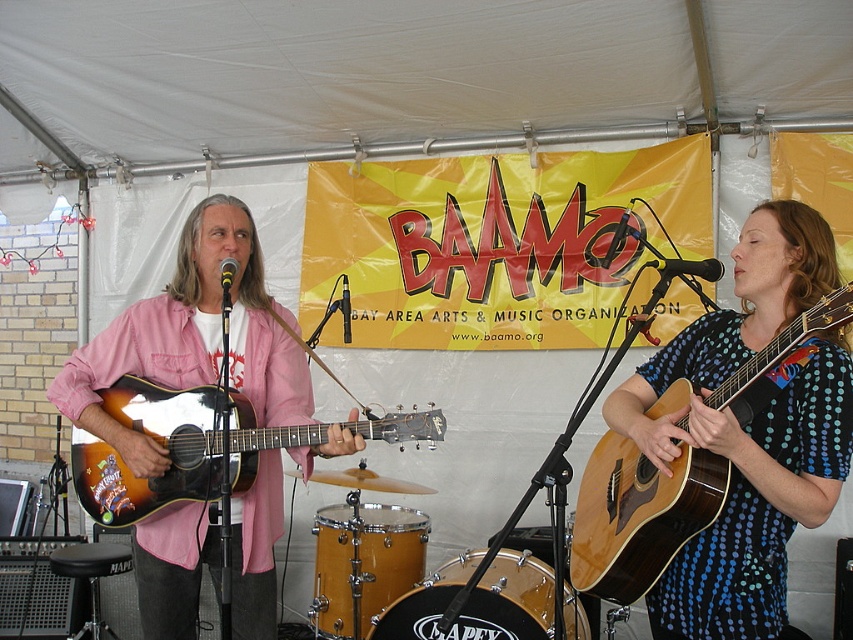
From the picture: Is black drumhead at center taller than yellow wood drum at lower center?

No.

Can you confirm if black drumhead at center is shorter than yellow wood drum at lower center?

Yes, black drumhead at center is shorter than yellow wood drum at lower center.

Who is more distant from viewer, (x=482, y=577) or (x=347, y=573)?

Point (x=347, y=573)

You are a GUI agent. You are given a task and a screenshot of the screen. Output one action in this format:
    pyautogui.click(x=<x>, y=<y>)
    Task: Click on the black drumhead at center
    This screenshot has width=853, height=640.
    Given the screenshot: What is the action you would take?
    pyautogui.click(x=485, y=602)

Can you confirm if natural wood acoustic guitar at right is positioned to the right of sunburst wood acoustic guitar at left?

Yes, natural wood acoustic guitar at right is to the right of sunburst wood acoustic guitar at left.

Does natural wood acoustic guitar at right appear on the left side of sunburst wood acoustic guitar at left?

Incorrect, natural wood acoustic guitar at right is not on the left side of sunburst wood acoustic guitar at left.

Between point (660, 506) and point (126, 406), which one is positioned behind?

The point (126, 406) is more distant.

The image size is (853, 640). Identify the location of natural wood acoustic guitar at right. (x=639, y=515).

Can you confirm if sunburst wood acoustic guitar at left is smaller than yellow wood drum at lower center?

No.

Is sunburst wood acoustic guitar at left to the right of yellow wood drum at lower center from the viewer's perspective?

In fact, sunburst wood acoustic guitar at left is to the left of yellow wood drum at lower center.

Between point (196, 468) and point (340, 627), which one is positioned behind?

Point (340, 627)

Where is `sunburst wood acoustic guitar at left`? The height and width of the screenshot is (640, 853). sunburst wood acoustic guitar at left is located at coordinates 175,449.